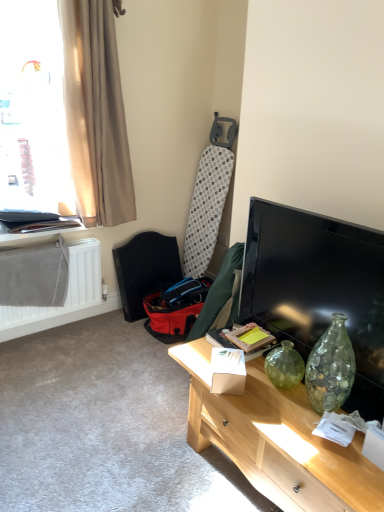
Question: Based on their sizes in the image, would you say matte black folder at upper left is bigger or smaller than matte black tv at right?

Choices:
 (A) big
 (B) small

Answer: (B)

Question: Is matte black folder at upper left inside or outside of matte black tv at right?

Choices:
 (A) outside
 (B) inside

Answer: (A)

Question: Considering the real-world distances, which object is farthest from the translucent beige curtain at upper left?

Choices:
 (A) red fabric swivel chair at lower left
 (B) matte wooden desk at lower right
 (C) beige fabric curtain at upper left
 (D) white matte radiator at lower left
 (E) matte black folder at upper left

Answer: (B)

Question: Estimate the real-world distances between objects in this image. Which object is farther from the matte wooden desk at lower right?

Choices:
 (A) translucent beige curtain at upper left
 (B) matte black folder at upper left
 (C) red fabric swivel chair at lower left
 (D) beige fabric curtain at upper left
 (E) white matte radiator at lower left

Answer: (A)